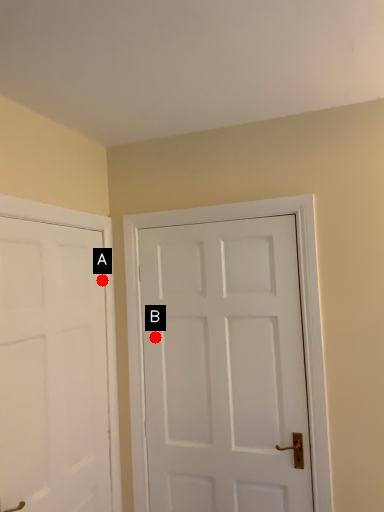
Question: Two points are circled on the image, labeled by A and B beside each circle. Which point is closer to the camera?

Choices:
 (A) A is closer
 (B) B is closer

Answer: (B)